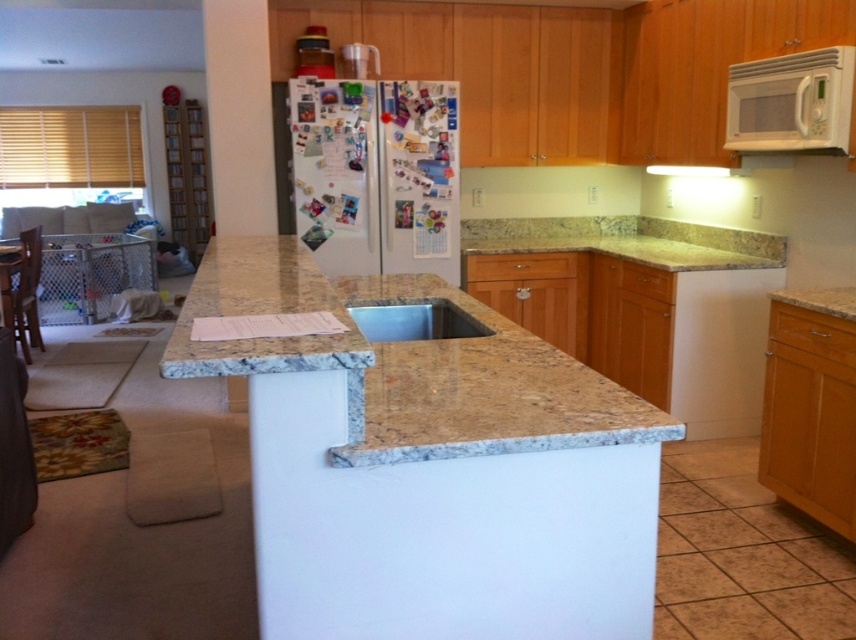
Is beige granite countertop at center wider than metallic stainless steel sink at center?

Correct, the width of beige granite countertop at center exceeds that of metallic stainless steel sink at center.

Who is lower down, beige granite countertop at center or metallic stainless steel sink at center?

metallic stainless steel sink at center

Which is behind, point (351, 424) or point (417, 333)?

The point (417, 333) is behind.

Where is `beige granite countertop at center`? beige granite countertop at center is located at coordinates (406, 364).

Does white matte refrigerator at upper center appear over white matte microwave at upper right?

Actually, white matte refrigerator at upper center is below white matte microwave at upper right.

Which is in front, point (330, 106) or point (816, 72)?

Positioned in front is point (816, 72).

Locate an element on the screen. white matte refrigerator at upper center is located at coordinates tap(377, 173).

The width and height of the screenshot is (856, 640). In order to click on white matte refrigerator at upper center in this screenshot , I will do `click(377, 173)`.

Is beige granite countertop at center shorter than yellow granite countertop at upper right?

In fact, beige granite countertop at center may be taller than yellow granite countertop at upper right.

Which is behind, point (223, 369) or point (777, 248)?

The point (777, 248) is more distant.

You are a GUI agent. You are given a task and a screenshot of the screen. Output one action in this format:
    pyautogui.click(x=<x>, y=<y>)
    Task: Click on the beige granite countertop at center
    
    Given the screenshot: What is the action you would take?
    pyautogui.click(x=406, y=364)